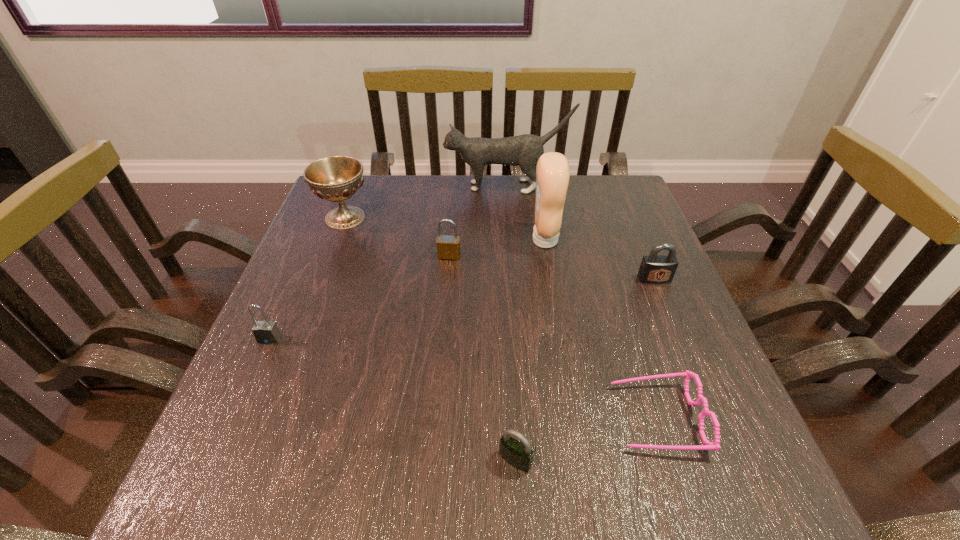
The width and height of the screenshot is (960, 540). What are the coordinates of `the shortest object` in the screenshot? It's located at (708, 445).

In order to click on vacant space located 0.290m at the face of the farthest object in this screenshot , I will do `click(347, 186)`.

This screenshot has height=540, width=960. Find the location of `vacant space located at the face of the farthest object`. vacant space located at the face of the farthest object is located at coordinates (353, 186).

This screenshot has width=960, height=540. Find the location of `free location located 0.330m at the face of the farthest object`. free location located 0.330m at the face of the farthest object is located at coordinates (333, 186).

Locate an element on the screen. free spot located on the label of the condiment is located at coordinates (471, 240).

This screenshot has width=960, height=540. Find the location of `vacant space situated 0.150m on the label of the condiment`. vacant space situated 0.150m on the label of the condiment is located at coordinates (471, 240).

Where is `free point located on the label of the condiment`? free point located on the label of the condiment is located at coordinates (396, 240).

Identify the location of vacant space located 0.060m on the right of the chalice. (395, 218).

The width and height of the screenshot is (960, 540). I want to click on vacant point located 0.080m on the left of the farthest padlock, so 405,256.

This screenshot has height=540, width=960. I want to click on blank space located 0.150m on the front of the second farthest padlock near the keyhole, so click(679, 336).